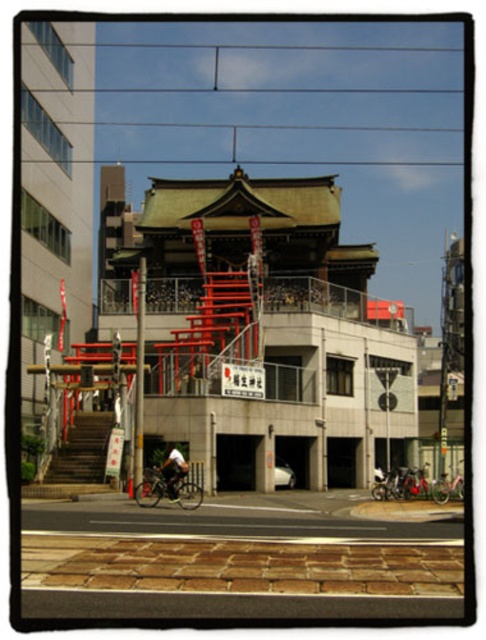
Question: Does silver metallic bicycle at center have a lesser width compared to white fabric shirt at center?

Choices:
 (A) yes
 (B) no

Answer: (B)

Question: Based on their relative distances, which object is nearer to the metallic silver bicycle at lower right?

Choices:
 (A) silver metallic bicycle at center
 (B) shiny metallic bicycle at center

Answer: (B)

Question: Which point appears farthest from the camera in this image?

Choices:
 (A) (177, 496)
 (B) (175, 497)
 (C) (434, 493)

Answer: (C)

Question: Which object appears closest to the camera in this image?

Choices:
 (A) white fabric shirt at center
 (B) shiny metallic bicycle at center
 (C) metallic silver bicycle at lower right
 (D) silver metallic bicycle at center

Answer: (D)

Question: Is silver metallic bicycle at center to the left of metallic silver bicycle at lower right from the viewer's perspective?

Choices:
 (A) no
 (B) yes

Answer: (B)

Question: Can you confirm if silver metallic bicycle at center is smaller than shiny metallic bicycle at center?

Choices:
 (A) no
 (B) yes

Answer: (B)